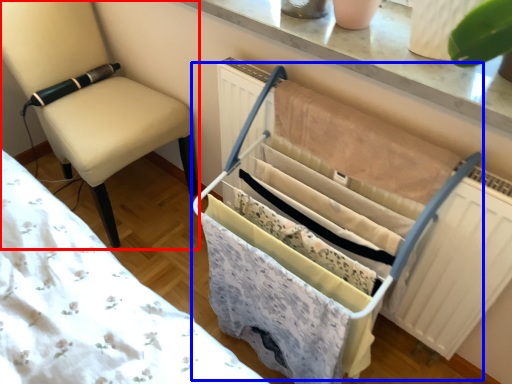
Question: Which of the following is the closest to the observer, chair (highlighted by a red box) or baby carriage (highlighted by a blue box)?

Choices:
 (A) chair
 (B) baby carriage

Answer: (B)